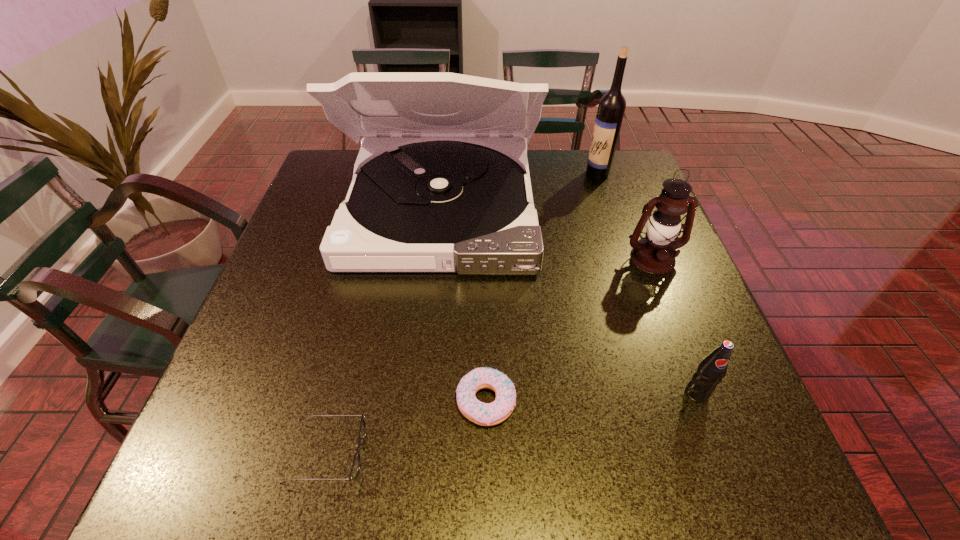
Where is `vacant region between the shortest object and the lantern`? This screenshot has height=540, width=960. vacant region between the shortest object and the lantern is located at coordinates (490, 356).

You are a GUI agent. You are given a task and a screenshot of the screen. Output one action in this format:
    pyautogui.click(x=<x>, y=<y>)
    Task: Click on the vacant region between the lantern and the spectacles
    
    Given the screenshot: What is the action you would take?
    pyautogui.click(x=490, y=356)

Identify the location of vacant area between the doughnut and the pop. (591, 397).

Where is `free space between the pop and the doughnut`? free space between the pop and the doughnut is located at coordinates (591, 397).

Locate an element on the screen. The height and width of the screenshot is (540, 960). vacant point located between the fifth tallest object and the third tallest object is located at coordinates (569, 330).

Locate an element on the screen. This screenshot has width=960, height=540. free space between the CD player and the spectacles is located at coordinates (384, 331).

You are a GUI agent. You are given a task and a screenshot of the screen. Output one action in this format:
    pyautogui.click(x=<x>, y=<y>)
    Task: Click on the vacant area between the third shortest object and the fifth tallest object
    The image size is (960, 540).
    Given the screenshot: What is the action you would take?
    pyautogui.click(x=591, y=397)

Locate an element on the screen. This screenshot has width=960, height=540. free space between the lantern and the wine bottle is located at coordinates (625, 216).

Choose which object is the third nearest neighbor to the doughnut. Please provide its 2D coordinates. Your answer should be formatted as a tuple, i.e. [(x, y)], where the tuple contains the x and y coordinates of a point satisfying the conditions above.

[(710, 371)]

Select which object is the third closest to the spectacles. Please provide its 2D coordinates. Your answer should be formatted as a tuple, i.e. [(x, y)], where the tuple contains the x and y coordinates of a point satisfying the conditions above.

[(710, 371)]